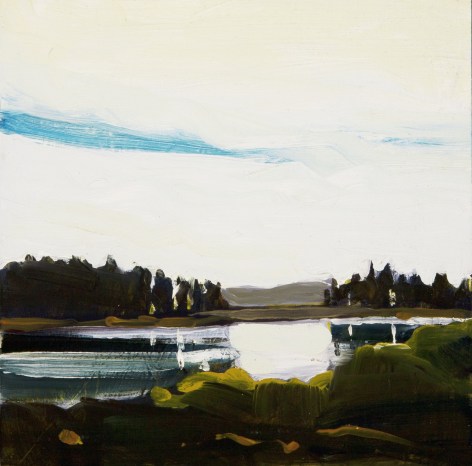
The height and width of the screenshot is (466, 472). I want to click on art, so click(x=262, y=346).